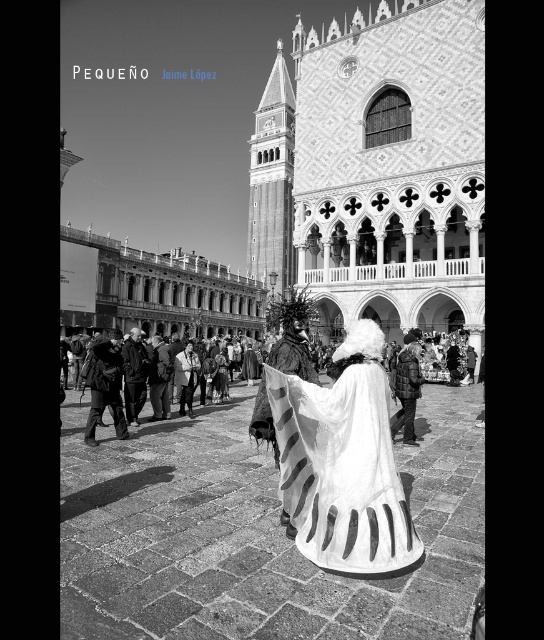
Question: Considering the real-world distances, which object is farthest from the white matte dress at center?

Choices:
 (A) dark gray fabric coat at center
 (B) dark brown leather jacket at center
 (C) white fur coat at center
 (D) white textured cape at center

Answer: (B)

Question: Considering the relative positions of white fur coat at center and white textured cape at center in the image provided, where is white fur coat at center located with respect to white textured cape at center?

Choices:
 (A) right
 (B) left

Answer: (B)

Question: Which point appears closest to the camera in this image?

Choices:
 (A) (123, 368)
 (B) (479, 269)

Answer: (A)

Question: Can you confirm if dark gray fabric coat at center is wider than dark brown leather jacket at center?

Choices:
 (A) no
 (B) yes

Answer: (B)

Question: Is polished stone palace at center wider than dark brown leather jacket at center?

Choices:
 (A) yes
 (B) no

Answer: (A)

Question: Which of the following is the closest to the observer?

Choices:
 (A) (151, 387)
 (B) (263, 433)
 (C) (141, 381)

Answer: (B)